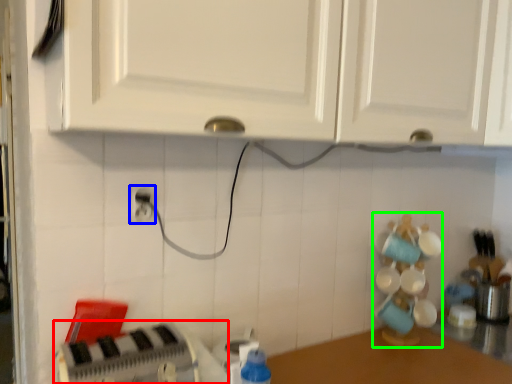
Question: Estimate the real-world distances between objects in this image. Which object is closer to appliance (highlighted by a red box), electric outlet (highlighted by a blue box) or toy (highlighted by a green box)?

Choices:
 (A) electric outlet
 (B) toy

Answer: (A)